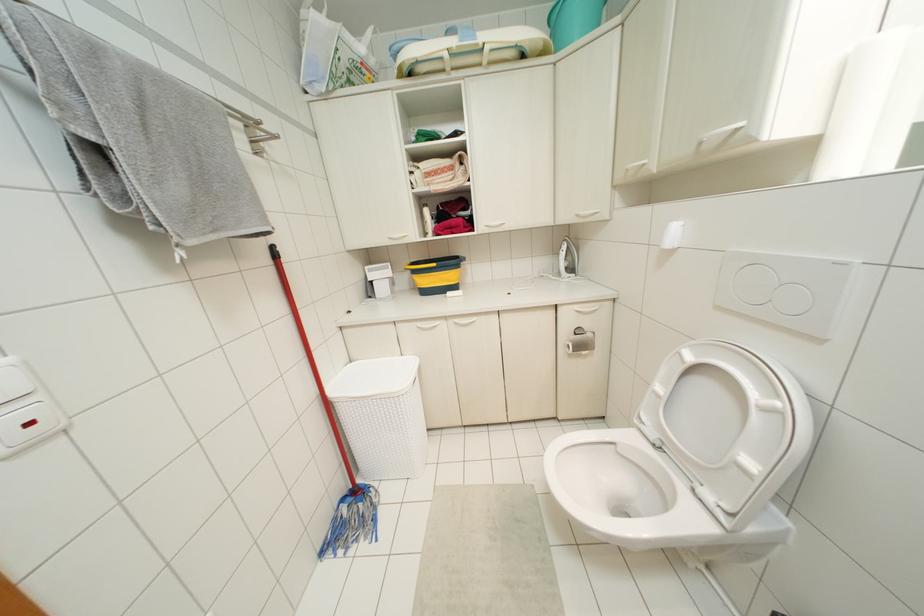
Find where to lift the red mop handle. Please return your answer as a coordinate pair (x, y).

(310, 360)